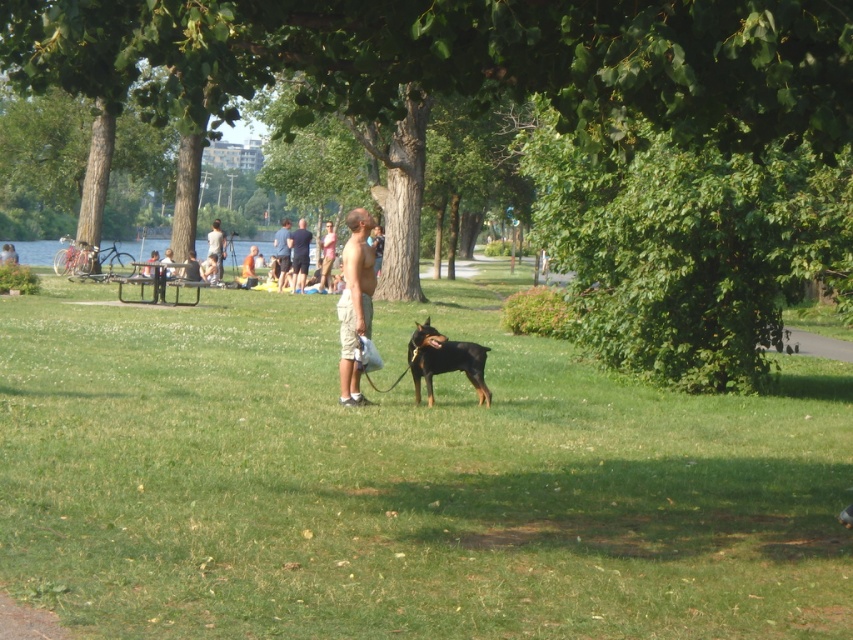
In the scene shown: Which is above, smooth skin man at center or smooth tan shorts at center?

smooth tan shorts at center is above.

Which is in front, point (357, 396) or point (207, 234)?

Positioned in front is point (357, 396).

Identify the location of smooth skin man at center. (354, 301).

Is point (296, 236) positioned after point (281, 257)?

No, (296, 236) is closer to viewer.

Does point (299, 248) lie behind point (287, 259)?

No, (299, 248) is in front of (287, 259).

Image resolution: width=853 pixels, height=640 pixels. I want to click on dark blue shirt at center, so point(299,256).

Between green grass at center and smooth blue shirt at center, which one has less height?

green grass at center

Which is behind, point (767, 413) or point (283, 237)?

The point (283, 237) is behind.

You are a GUI agent. You are given a task and a screenshot of the screen. Output one action in this format:
    pyautogui.click(x=<x>, y=<y>)
    Task: Click on the green grass at center
    
    Given the screenshot: What is the action you would take?
    pyautogui.click(x=402, y=483)